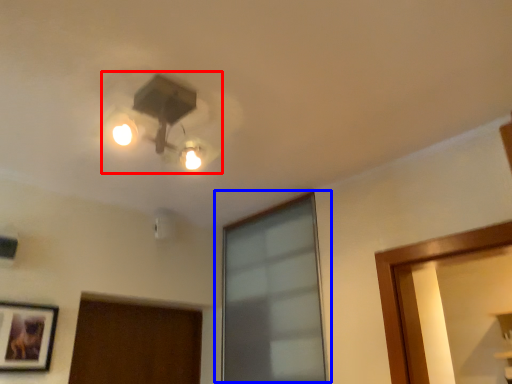
Question: Which point is closer to the camera, lamp (highlighted by a red box) or window (highlighted by a blue box)?

Choices:
 (A) lamp
 (B) window

Answer: (A)